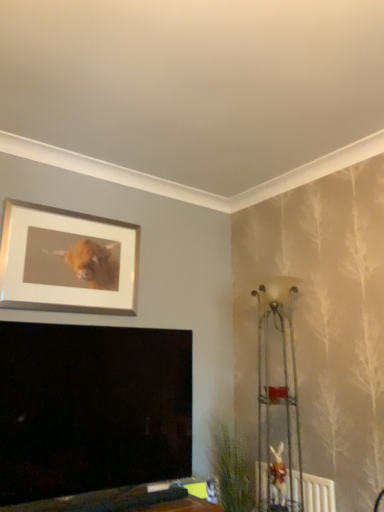
What is the approximate width of white textured radiator at lower right?

It is 2.65 inches.

Identify the location of metallic wire rack at right. The height and width of the screenshot is (512, 384). (284, 378).

Where is `green leafy plant at lower right`? The width and height of the screenshot is (384, 512). green leafy plant at lower right is located at coordinates (231, 468).

I want to click on white textured radiator at lower right, so click(x=318, y=494).

This screenshot has width=384, height=512. Find the location of `radiator that appears below the silver/metallic picture frame at upper left (from a real-world perspective)`. radiator that appears below the silver/metallic picture frame at upper left (from a real-world perspective) is located at coordinates (318, 494).

Which is behind, point (113, 295) or point (297, 479)?

The point (113, 295) is more distant.

Considering the relative sizes of silver/metallic picture frame at upper left and white textured radiator at lower right in the image provided, is silver/metallic picture frame at upper left wider than white textured radiator at lower right?

No, silver/metallic picture frame at upper left is not wider than white textured radiator at lower right.

Could you tell me if silver/metallic picture frame at upper left is turned towards white textured radiator at lower right?

No.

From the image's perspective, is white textured radiator at lower right below green leafy plant at lower right?

Yes, from the image's perspective, white textured radiator at lower right is below green leafy plant at lower right.

Measure the distance between white textured radiator at lower right and green leafy plant at lower right.

37.49 centimeters.

Could you tell me if white textured radiator at lower right is turned towards green leafy plant at lower right?

No, white textured radiator at lower right is not oriented towards green leafy plant at lower right.

How many degrees apart are the facing directions of white textured radiator at lower right and green leafy plant at lower right?

white textured radiator at lower right and green leafy plant at lower right are facing 90 degrees away from each other.

What's the angular difference between metallic wire rack at right and green leafy plant at lower right's facing directions?

The facing directions of metallic wire rack at right and green leafy plant at lower right are 48.1 degrees apart.

Relative to green leafy plant at lower right, is metallic wire rack at right in front or behind?

Visually, metallic wire rack at right is located in front of green leafy plant at lower right.

Considering the positions of points (285, 386) and (219, 431), is point (285, 386) closer to camera compared to point (219, 431)?

Yes, point (285, 386) is closer to viewer.

Can you confirm if metallic wire rack at right is positioned to the left of green leafy plant at lower right?

In fact, metallic wire rack at right is to the right of green leafy plant at lower right.

There is a white textured radiator at lower right. Where is `lamp above it (from a real-world perspective)`? lamp above it (from a real-world perspective) is located at coordinates (284, 378).

Is metallic wire rack at right bigger than white textured radiator at lower right?

Indeed, metallic wire rack at right has a larger size compared to white textured radiator at lower right.

Considering the sizes of white textured radiator at lower right and silver/metallic picture frame at upper left in the image, is white textured radiator at lower right taller or shorter than silver/metallic picture frame at upper left?

white textured radiator at lower right is shorter than silver/metallic picture frame at upper left.

Is white textured radiator at lower right bigger or smaller than silver/metallic picture frame at upper left?

In the image, white textured radiator at lower right appears to be smaller than silver/metallic picture frame at upper left.

Which object is further away from the camera taking this photo, white textured radiator at lower right or silver/metallic picture frame at upper left?

silver/metallic picture frame at upper left is further away from the camera.

Consider the image. How much distance is there between white textured radiator at lower right and silver/metallic picture frame at upper left?

white textured radiator at lower right and silver/metallic picture frame at upper left are 1.53 meters apart.

In the scene shown: Between green leafy plant at lower right and white textured radiator at lower right, which one has less height?

white textured radiator at lower right is shorter.

Measure the distance between green leafy plant at lower right and white textured radiator at lower right.

green leafy plant at lower right is 14.76 inches away from white textured radiator at lower right.

Is green leafy plant at lower right located outside white textured radiator at lower right?

Yes, green leafy plant at lower right is located beyond the bounds of white textured radiator at lower right.

Considering the positions of objects green leafy plant at lower right and metallic wire rack at right in the image provided, who is more to the left, green leafy plant at lower right or metallic wire rack at right?

green leafy plant at lower right.

From the image's perspective, which one is positioned higher, green leafy plant at lower right or metallic wire rack at right?

metallic wire rack at right is shown above in the image.

Considering the relative sizes of green leafy plant at lower right and metallic wire rack at right in the image provided, is green leafy plant at lower right thinner than metallic wire rack at right?

Indeed, green leafy plant at lower right has a lesser width compared to metallic wire rack at right.

Who is more distant, green leafy plant at lower right or metallic wire rack at right?

green leafy plant at lower right.

The width and height of the screenshot is (384, 512). I want to click on radiator that is under the silver/metallic picture frame at upper left (from a real-world perspective), so click(318, 494).

This screenshot has width=384, height=512. I want to click on plant that is on the left side of white textured radiator at lower right, so click(x=231, y=468).

From the image, which object appears to be farther from metallic wire rack at right, white textured radiator at lower right or silver/metallic picture frame at upper left?

Based on the image, silver/metallic picture frame at upper left appears to be further to metallic wire rack at right.

When comparing their distances from white textured radiator at lower right, does silver/metallic picture frame at upper left or green leafy plant at lower right seem closer?

Among the two, green leafy plant at lower right is located nearer to white textured radiator at lower right.

Looking at the image, which one is located further to silver/metallic picture frame at upper left, metallic wire rack at right or white textured radiator at lower right?

white textured radiator at lower right lies further to silver/metallic picture frame at upper left than the other object.

Which object lies further to the anchor point green leafy plant at lower right, silver/metallic picture frame at upper left or metallic wire rack at right?

Among the two, silver/metallic picture frame at upper left is located further to green leafy plant at lower right.

When comparing their distances from silver/metallic picture frame at upper left, does white textured radiator at lower right or green leafy plant at lower right seem further?

white textured radiator at lower right lies further to silver/metallic picture frame at upper left than the other object.

Which object lies further to the anchor point metallic wire rack at right, silver/metallic picture frame at upper left or white textured radiator at lower right?

The object further to metallic wire rack at right is silver/metallic picture frame at upper left.

In the scene shown: When comparing their distances from metallic wire rack at right, does silver/metallic picture frame at upper left or green leafy plant at lower right seem closer?

green leafy plant at lower right is closer to metallic wire rack at right.

From the image, which object appears to be nearer to green leafy plant at lower right, metallic wire rack at right or white textured radiator at lower right?

white textured radiator at lower right is closer to green leafy plant at lower right.

Locate an element on the screen. This screenshot has height=512, width=384. plant between metallic wire rack at right and white textured radiator at lower right in the up-down direction is located at coordinates (231, 468).

I want to click on lamp between silver/metallic picture frame at upper left and white textured radiator at lower right from left to right, so point(284,378).

The width and height of the screenshot is (384, 512). Identify the location of plant between silver/metallic picture frame at upper left and white textured radiator at lower right in the up-down direction. (231, 468).

I want to click on lamp between silver/metallic picture frame at upper left and green leafy plant at lower right vertically, so click(x=284, y=378).